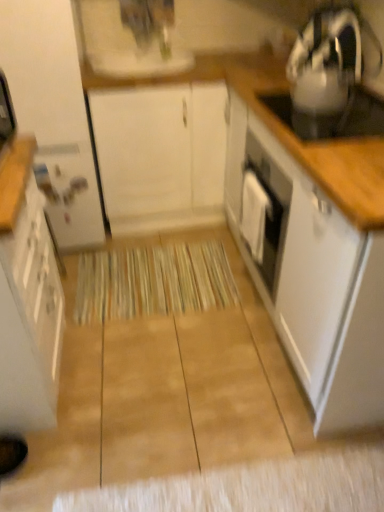
Question: Can you confirm if metallic silver kettle at upper right is bigger than white glossy cabinet at right, arranged as the first cabinetry when viewed from the right?

Choices:
 (A) no
 (B) yes

Answer: (A)

Question: From the image's perspective, is metallic silver kettle at upper right located beneath white glossy cabinet at right, arranged as the first cabinetry when viewed from the right?

Choices:
 (A) no
 (B) yes

Answer: (A)

Question: Can you confirm if metallic silver kettle at upper right is wider than white glossy cabinet at right, which ranks as the 4th cabinetry in left-to-right order?

Choices:
 (A) no
 (B) yes

Answer: (A)

Question: Does metallic silver kettle at upper right come in front of white glossy cabinet at right, which ranks as the 4th cabinetry in left-to-right order?

Choices:
 (A) no
 (B) yes

Answer: (B)

Question: Does metallic silver kettle at upper right turn towards white glossy cabinet at right, which ranks as the 4th cabinetry in left-to-right order?

Choices:
 (A) no
 (B) yes

Answer: (A)

Question: Does metallic silver kettle at upper right have a lesser height compared to white glossy cabinet at right, which ranks as the 4th cabinetry in left-to-right order?

Choices:
 (A) no
 (B) yes

Answer: (B)

Question: Is white glossy cabinet at left, which ranks as the 1th cabinetry in left-to-right order, a part of metallic silver kettle at upper right?

Choices:
 (A) no
 (B) yes

Answer: (A)

Question: From a real-world perspective, is metallic silver kettle at upper right on white glossy cabinet at left, acting as the fourth cabinetry starting from the right?

Choices:
 (A) yes
 (B) no

Answer: (A)

Question: Does metallic silver kettle at upper right have a lesser width compared to white glossy cabinet at left, acting as the fourth cabinetry starting from the right?

Choices:
 (A) yes
 (B) no

Answer: (A)

Question: Is white glossy cabinet at left, which ranks as the 1th cabinetry in left-to-right order, at the back of metallic silver kettle at upper right?

Choices:
 (A) yes
 (B) no

Answer: (B)

Question: Considering the relative sizes of metallic silver kettle at upper right and white glossy cabinet at left, which ranks as the 1th cabinetry in left-to-right order, in the image provided, is metallic silver kettle at upper right wider than white glossy cabinet at left, which ranks as the 1th cabinetry in left-to-right order,?

Choices:
 (A) no
 (B) yes

Answer: (A)

Question: Is the depth of metallic silver kettle at upper right greater than that of white glossy cabinet at left, acting as the fourth cabinetry starting from the right?

Choices:
 (A) yes
 (B) no

Answer: (B)

Question: Is white matte cabinet at center, acting as the third cabinetry starting from the left, positioned with its back to white glossy cabinet at left, which ranks as the 1th cabinetry in left-to-right order?

Choices:
 (A) no
 (B) yes

Answer: (A)